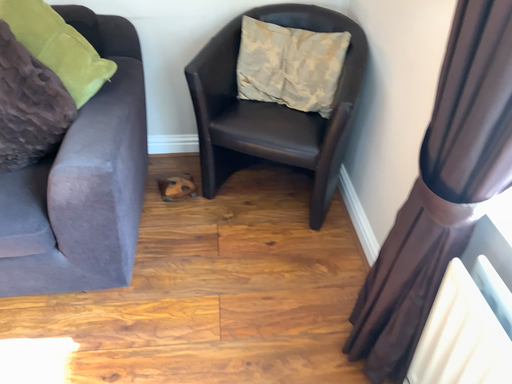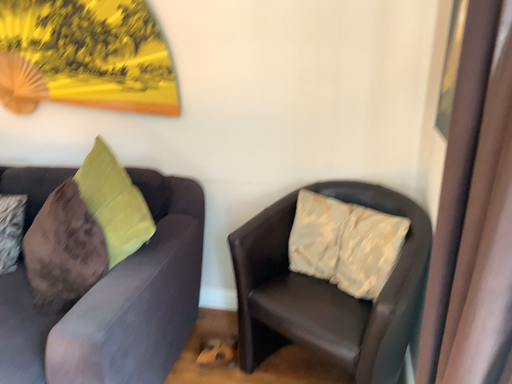
Question: How did the camera likely rotate when shooting the video?

Choices:
 (A) rotated upward
 (B) rotated downward

Answer: (A)